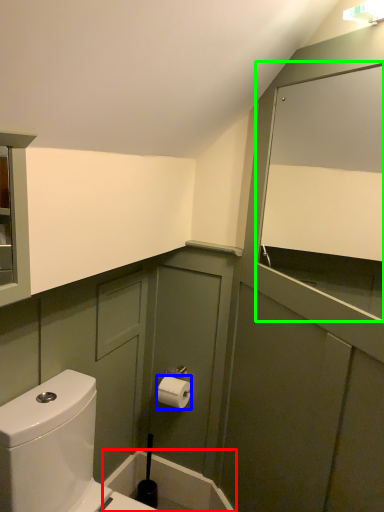
Question: Estimate the real-world distances between objects in this image. Which object is farther from bath (highlighted by a red box), toiletry (highlighted by a blue box) or mirror (highlighted by a green box)?

Choices:
 (A) toiletry
 (B) mirror

Answer: (B)